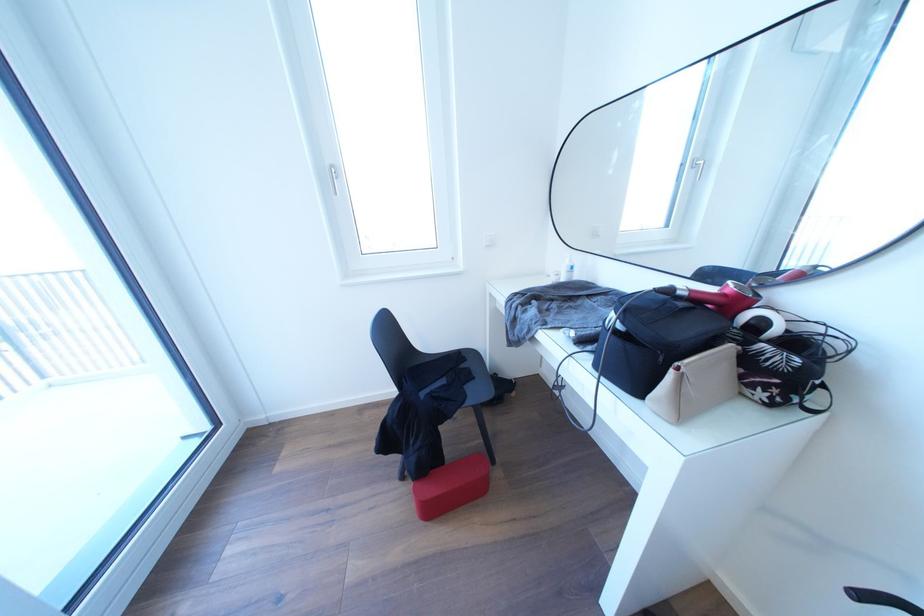
Where would you press the white bottle pump? Please return your answer as a coordinate pair (x, y).

(567, 268)